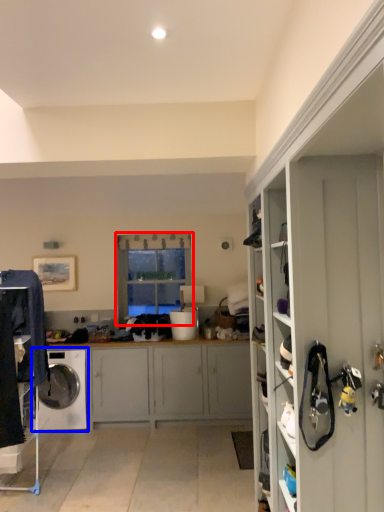
Question: Which object appears farthest to the camera in this image, window (highlighted by a red box) or washing machine (highlighted by a blue box)?

Choices:
 (A) window
 (B) washing machine

Answer: (A)